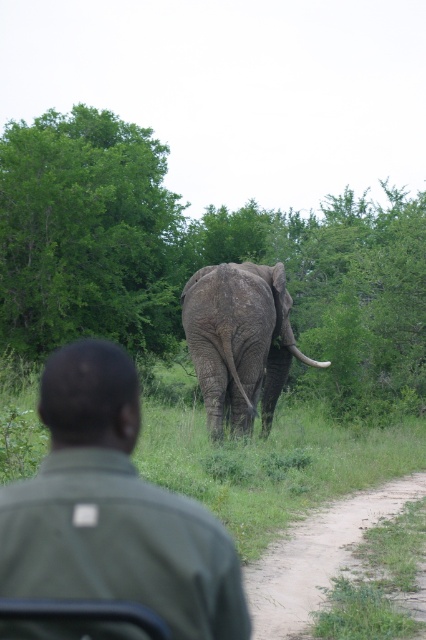
Is gray rough elephant at center wider than dirt/grass at lower right?

Indeed, gray rough elephant at center has a greater width compared to dirt/grass at lower right.

Does gray rough elephant at center have a lesser height compared to dirt/grass at lower right?

Incorrect, gray rough elephant at center's height does not fall short of dirt/grass at lower right's.

Is point (259, 276) more distant than point (284, 609)?

Yes, it is behind point (284, 609).

I want to click on gray rough elephant at center, so tap(238, 340).

Who is higher up, green leafy tree at center or gray rough elephant at center?

green leafy tree at center is higher up.

Which is behind, point (270, 241) or point (285, 307)?

The point (270, 241) is behind.

Describe the element at coordinates (201, 259) in the screenshot. This screenshot has width=426, height=640. I see `green leafy tree at center` at that location.

The image size is (426, 640). In order to click on green leafy tree at center in this screenshot , I will do `click(201, 259)`.

The width and height of the screenshot is (426, 640). What do you see at coordinates (112, 509) in the screenshot? I see `green matte shirt at center` at bounding box center [112, 509].

Measure the distance between green matte shirt at center and white ivory tusk at upper center.

green matte shirt at center and white ivory tusk at upper center are 13.03 meters apart from each other.

Who is more forward, (126, 502) or (313, 362)?

Positioned in front is point (126, 502).

This screenshot has height=640, width=426. Identify the location of green matte shirt at center. (112, 509).